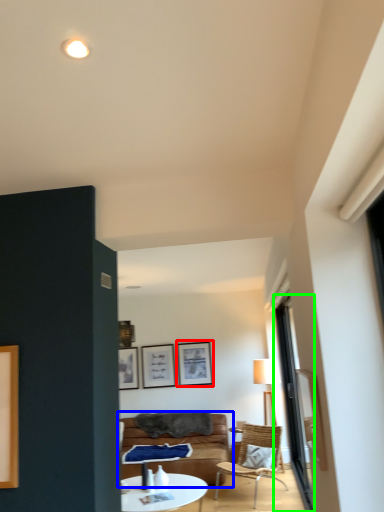
Question: Which object is positioned closest to picture frame (highlighted by a red box)? Select from studio couch (highlighted by a blue box) and window (highlighted by a green box).

Choices:
 (A) studio couch
 (B) window

Answer: (A)